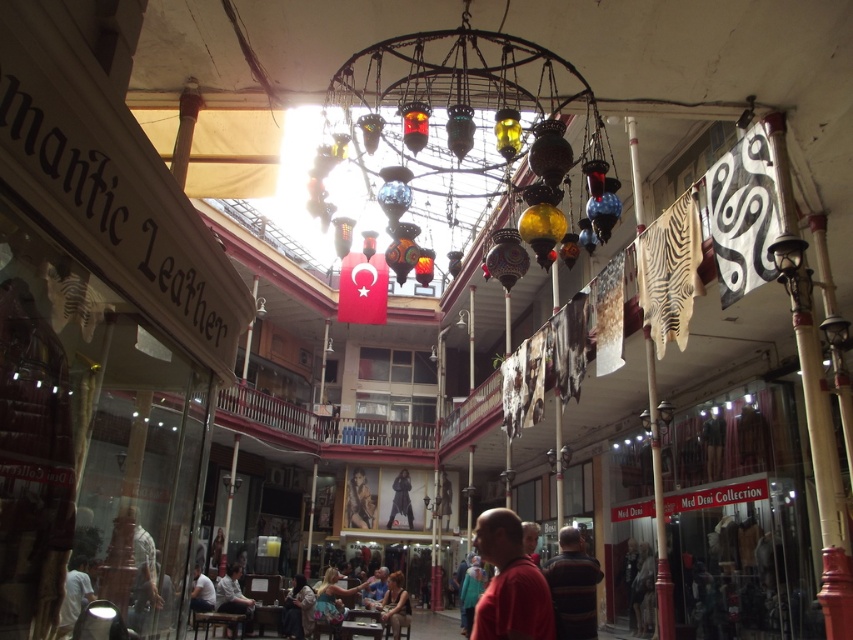
Question: Is dark brown leather jacket at lower center smaller than light brown leather jacket at lower center?

Choices:
 (A) no
 (B) yes

Answer: (B)

Question: Which object is farther from the camera taking this photo?

Choices:
 (A) smooth skin portrait at center
 (B) light brown leather jacket at lower center
 (C) smooth brown leather chair at center
 (D) striped sweater at center

Answer: (A)

Question: Does fluffy multicolored scarf at center come behind dark blue leather jacket at center?

Choices:
 (A) no
 (B) yes

Answer: (A)

Question: Can you confirm if matte red shirt at center is wider than striped sweater at center?

Choices:
 (A) no
 (B) yes

Answer: (B)

Question: Which object is the farthest from the matte red shirt at center?

Choices:
 (A) dark brown leather jacket at lower center
 (B) multicolored glass lanterns at center
 (C) striped sweater at center

Answer: (B)

Question: Which object is farther from the camera taking this photo?

Choices:
 (A) smooth skin portrait at center
 (B) striped sweater at center
 (C) fluffy multicolored scarf at center
 (D) multicolored glass lanterns at center

Answer: (A)